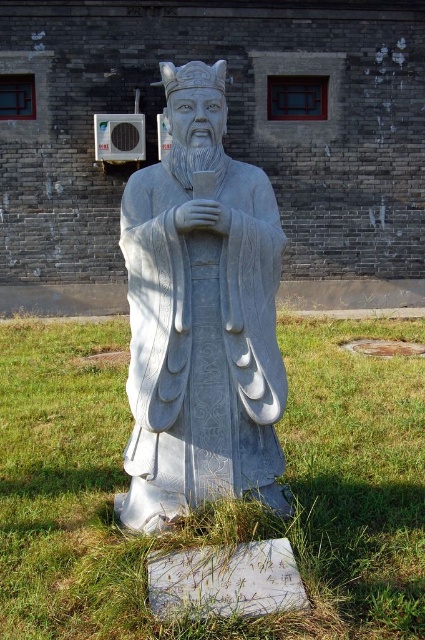
Between green grass at center and white stone statue at center, which one is positioned lower?

green grass at center

In the scene shown: Does green grass at center come behind white stone statue at center?

That is True.

Image resolution: width=425 pixels, height=640 pixels. What do you see at coordinates (215, 506) in the screenshot? I see `green grass at center` at bounding box center [215, 506].

The height and width of the screenshot is (640, 425). I want to click on green grass at center, so [215, 506].